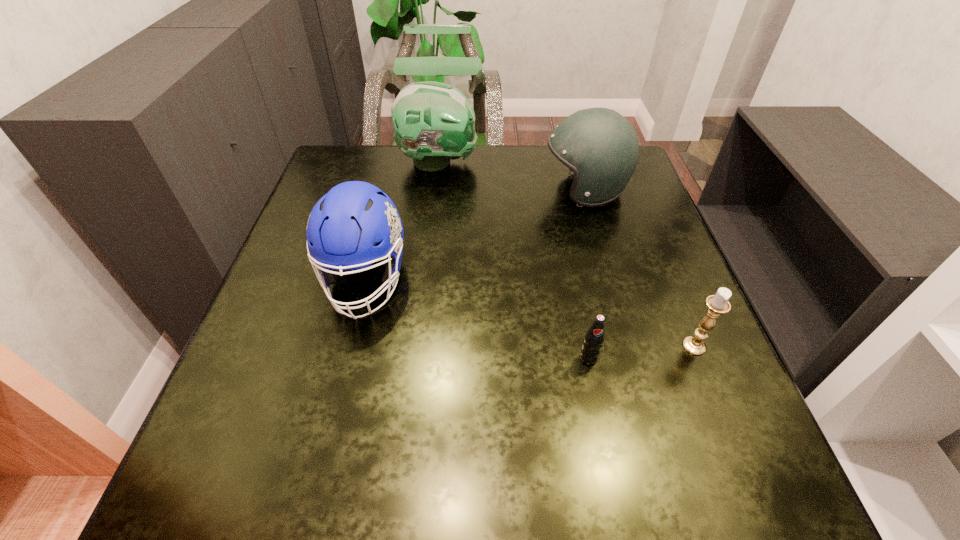
You are a GUI agent. You are given a task and a screenshot of the screen. Output one action in this format:
    pyautogui.click(x=<x>, y=<y>)
    Task: Click on the vacant position in the image that satisfies the following two spatial constraints: 1. at the face opening of the rightmost football helmet; 2. on the front label of the shortest object
    The image size is (960, 540).
    Given the screenshot: What is the action you would take?
    pyautogui.click(x=632, y=357)